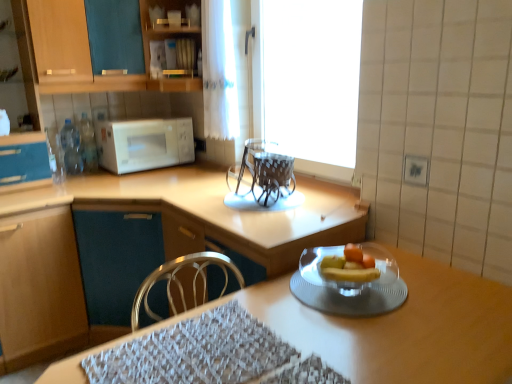
Question: Is point (231, 170) positioned closer to the camera than point (10, 276)?

Choices:
 (A) closer
 (B) farther

Answer: (B)

Question: Is transparent plastic chairs at center inside the boundaries of matte wood cabinet at lower left, which is the 1th cabinetry from bottom to top, or outside?

Choices:
 (A) outside
 (B) inside

Answer: (A)

Question: Based on their relative distances, which object is farther from the matte wood cabinet at lower left, which is the 1th cabinetry from bottom to top?

Choices:
 (A) transparent glass plate at lower right
 (B) woven fabric place mat at lower center
 (C) wooden table at center
 (D) white glossy microwave at upper left
 (E) matte wood cabinet at left, which appears as the second cabinetry when ordered from the bottom

Answer: (A)

Question: Estimate the real-world distances between objects in this image. Which object is closer to the wooden cabinet at upper left, acting as the 3th cabinetry starting from the bottom?

Choices:
 (A) transparent plastic chairs at center
 (B) wooden table at center
 (C) transparent glass plate at lower right
 (D) white glossy microwave at upper left
 (E) woven fabric place mat at lower center

Answer: (D)